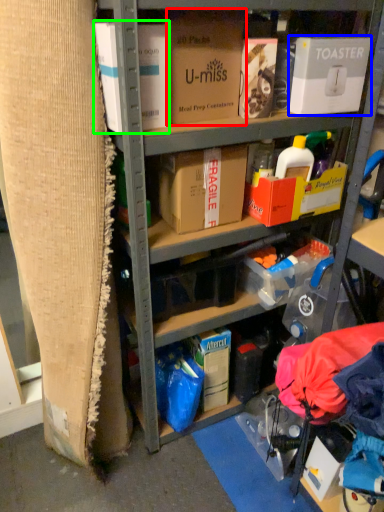
Question: Which is farther away from box (highlighted by a red box)? box (highlighted by a blue box) or box (highlighted by a green box)?

Choices:
 (A) box
 (B) box

Answer: (A)